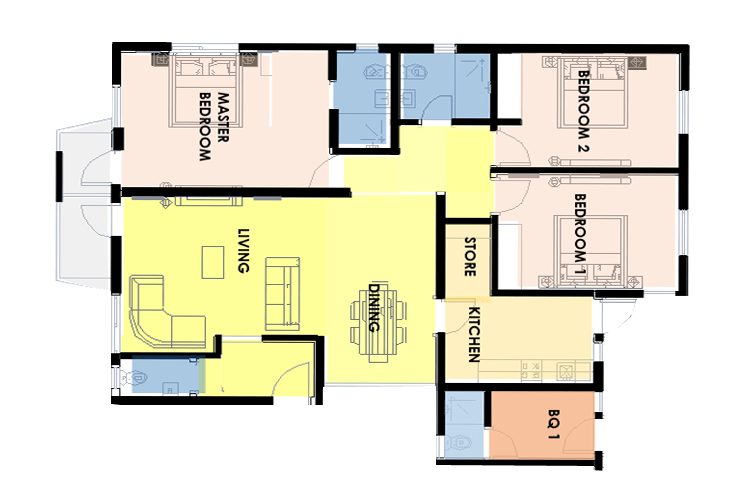
Where is `living room`? living room is located at coordinates (220, 274).